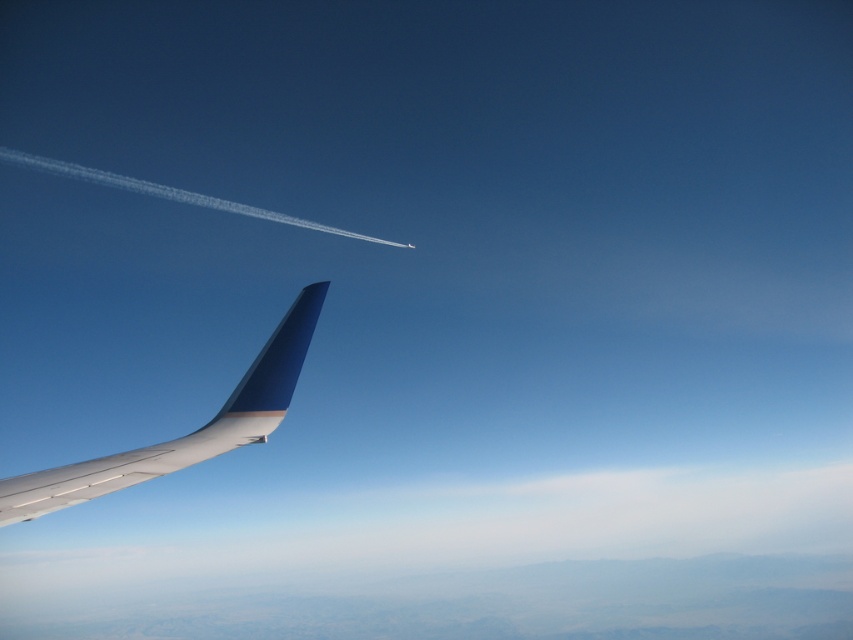
Question: Which of the following is the farthest from the observer?

Choices:
 (A) white fluffy cloud at lower center
 (B) metallic blue winglet at lower left

Answer: (A)

Question: Does white fluffy cloud at lower center come behind metallic blue winglet at lower left?

Choices:
 (A) yes
 (B) no

Answer: (A)

Question: Which of the following is the farthest from the observer?

Choices:
 (A) white fluffy cloud at lower center
 (B) metallic blue winglet at lower left

Answer: (A)

Question: Which point is closer to the camera?

Choices:
 (A) (393, 522)
 (B) (184, 461)

Answer: (B)

Question: Does white fluffy cloud at lower center appear on the left side of metallic blue winglet at lower left?

Choices:
 (A) yes
 (B) no

Answer: (A)

Question: Is white fluffy cloud at lower center above metallic blue winglet at lower left?

Choices:
 (A) no
 (B) yes

Answer: (A)